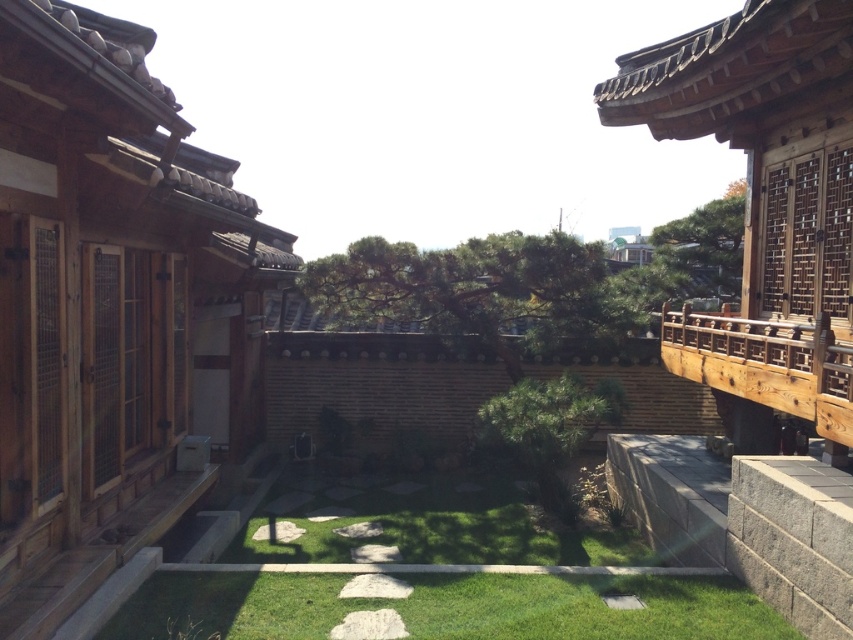
You are planning to host a small gathering in the courtyard of the traditional Korean house. You need to set up a 3m long table. Based on the image, which area between the wooden terrace at left and the green grass at center can accommodate the table?

The green grass at center has a greater width than the wooden terrace at left, so the green grass at center can accommodate the 3m long table.